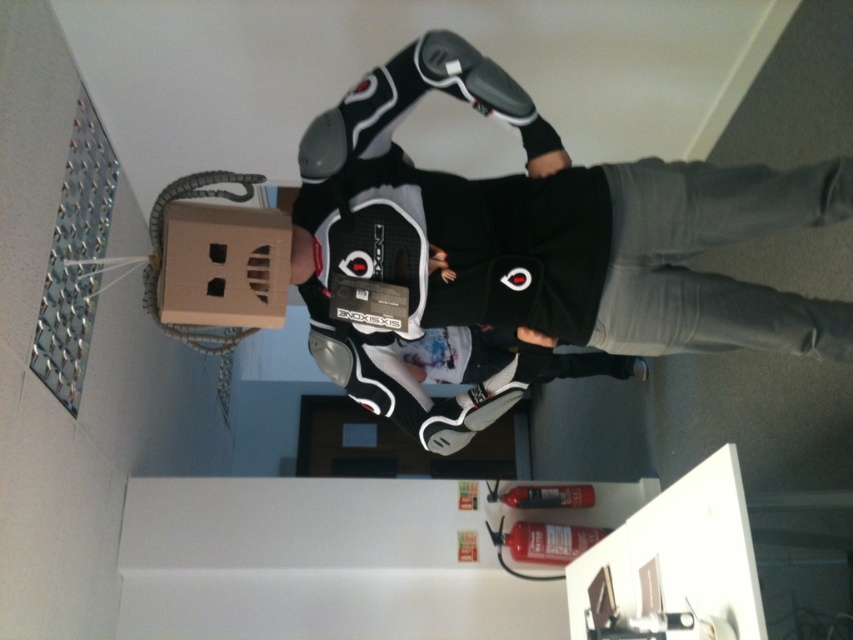
You are an observer looking at the scene. Which object is closer to you between the black matte jacket at center and the cardboard box at upper left?

The black matte jacket at center is closer to you than the cardboard box at upper left because it is further to the viewer.